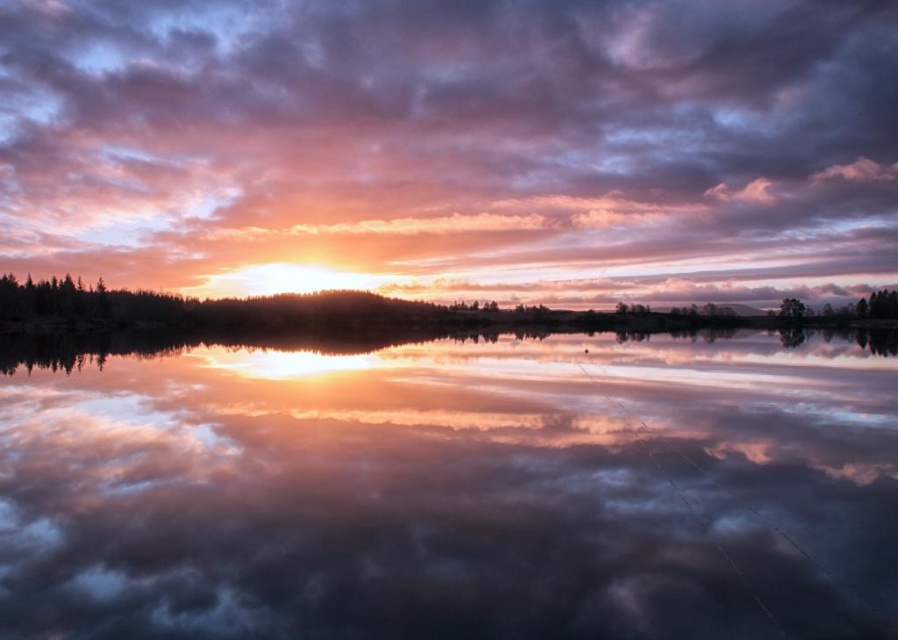
Is green matte trees at center to the right of green matte tree at lower right from the viewer's perspective?

Incorrect, green matte trees at center is not on the right side of green matte tree at lower right.

Consider the image. Can you confirm if green matte trees at center is shorter than green matte tree at lower right?

No, green matte trees at center is not shorter than green matte tree at lower right.

Image resolution: width=898 pixels, height=640 pixels. I want to click on green matte trees at center, so click(x=288, y=308).

This screenshot has width=898, height=640. In order to click on green matte trees at center in this screenshot , I will do `click(288, 308)`.

Which is behind, point (33, 394) or point (782, 300)?

The point (782, 300) is more distant.

Which is below, reflective water at center or green matte tree at lower right?

Positioned lower is reflective water at center.

Which is in front, point (430, 449) or point (789, 317)?

Positioned in front is point (430, 449).

Find the location of a particular element. reflective water at center is located at coordinates (455, 490).

Which is behind, point (263, 262) or point (791, 298)?

The point (263, 262) is behind.

Does point (60, 67) come closer to viewer compared to point (800, 312)?

No, (60, 67) is behind (800, 312).

Identify the location of pastel pink cotton clouds at upper center. (453, 147).

I want to click on pastel pink cotton clouds at upper center, so click(x=453, y=147).